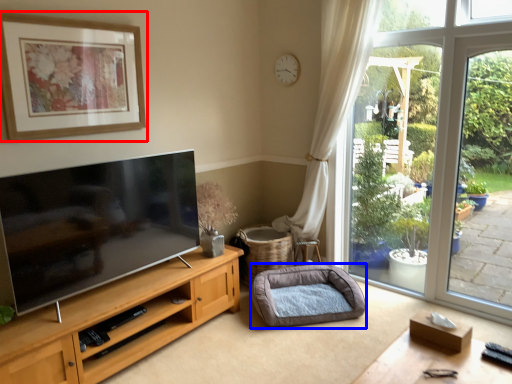
Question: Which of the following is the farthest to the observer, picture frame (highlighted by a red box) or dog bed (highlighted by a blue box)?

Choices:
 (A) picture frame
 (B) dog bed

Answer: (B)